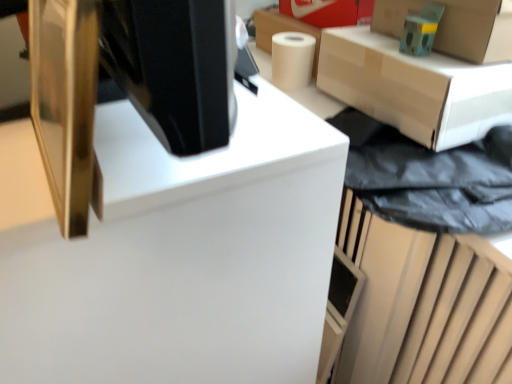
At what (x,y) coordinates should I click in order to perform the action: click on free area behind teal matte toy at upper right. Please return your answer as a coordinate pair (x, y). This screenshot has height=384, width=512. Looking at the image, I should click on (371, 35).